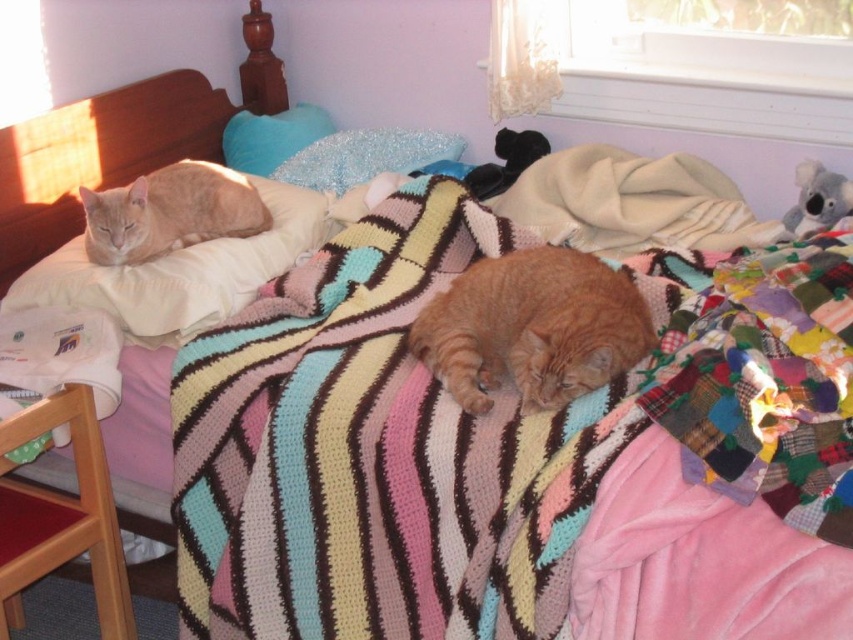
Question: Is orange fur cat at upper left below blue fuzzy pillow at upper center?

Choices:
 (A) no
 (B) yes

Answer: (B)

Question: Which point is closer to the camera?

Choices:
 (A) blue fuzzy pillow at upper center
 (B) white soft pillow at upper left
 (C) orange fur tabby cat at center

Answer: (C)

Question: Which of the following is the closest to the observer?

Choices:
 (A) coord(370,134)
 (B) coord(186,224)
 (C) coord(248,161)

Answer: (B)

Question: Can you confirm if orange fur tabby cat at center is positioned below blue fuzzy pillow at upper center?

Choices:
 (A) no
 (B) yes

Answer: (B)

Question: Is orange fur cat at upper left to the right of sparkly blue pillow at upper center from the viewer's perspective?

Choices:
 (A) yes
 (B) no

Answer: (B)

Question: Which point is farther to the camera?

Choices:
 (A) coord(264,173)
 (B) coord(122,262)
 (C) coord(276,211)
 (D) coord(451,285)

Answer: (A)